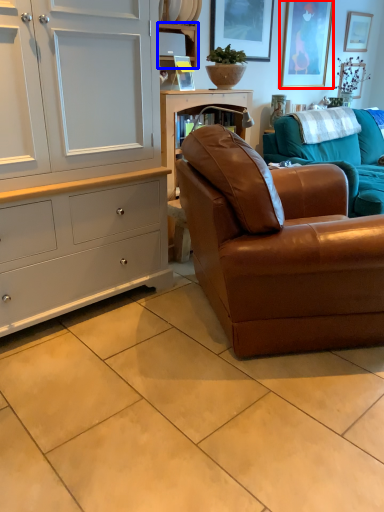
Question: Which object is further to the camera taking this photo, picture frame (highlighted by a red box) or shelf (highlighted by a blue box)?

Choices:
 (A) picture frame
 (B) shelf

Answer: (A)